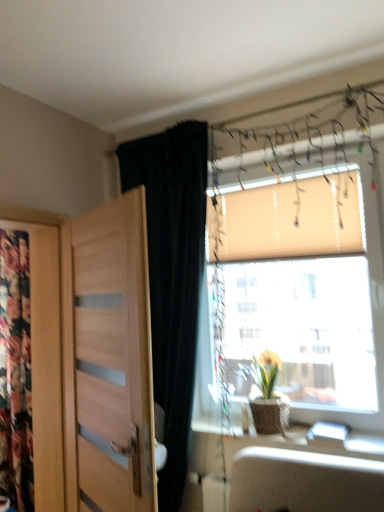
Identify the location of vacant region below green leafy plant in woven basket at window (from a real-world perspective). (270, 435).